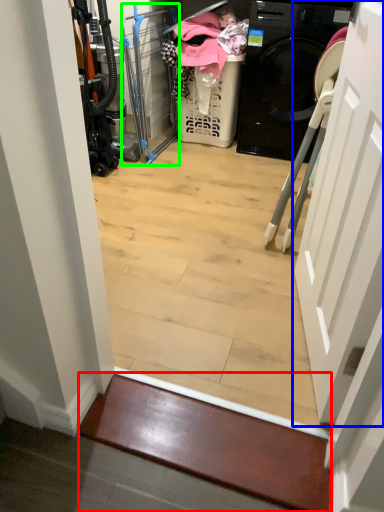
Question: Which is nearer to the stairwell (highlighted by a red box)? door (highlighted by a blue box) or screen door (highlighted by a green box).

Choices:
 (A) door
 (B) screen door

Answer: (A)